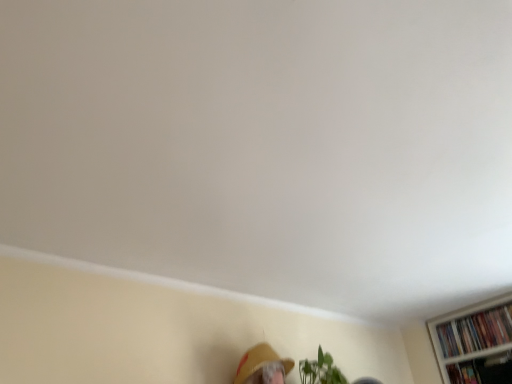
Question: Does matte yellow hat at lower center have a greater height compared to black matte bookshelf at lower right, positioned as the 1th book in front-to-back order?

Choices:
 (A) yes
 (B) no

Answer: (A)

Question: Is matte yellow hat at lower center positioned before black matte bookshelf at lower right, positioned as the 1th book in front-to-back order?

Choices:
 (A) yes
 (B) no

Answer: (A)

Question: Can you confirm if matte yellow hat at lower center is thinner than black matte bookshelf at lower right, the 2th book viewed from the back?

Choices:
 (A) no
 (B) yes

Answer: (A)

Question: Is the position of matte yellow hat at lower center more distant than that of black matte bookshelf at lower right, positioned as the 1th book in front-to-back order?

Choices:
 (A) yes
 (B) no

Answer: (B)

Question: From a real-world perspective, is matte yellow hat at lower center beneath black matte bookshelf at lower right, positioned as the 1th book in front-to-back order?

Choices:
 (A) no
 (B) yes

Answer: (A)

Question: Considering their positions, is matte yellow hat at lower center located in front of or behind black matte bookshelf at lower right, the 2th book viewed from the back?

Choices:
 (A) behind
 (B) front

Answer: (B)

Question: From the image's perspective, is matte yellow hat at lower center located above or below black matte bookshelf at lower right, positioned as the 1th book in front-to-back order?

Choices:
 (A) above
 (B) below

Answer: (A)

Question: Is matte yellow hat at lower center bigger or smaller than black matte bookshelf at lower right, the 2th book viewed from the back?

Choices:
 (A) big
 (B) small

Answer: (A)

Question: Is matte yellow hat at lower center taller or shorter than black matte bookshelf at lower right, the 2th book viewed from the back?

Choices:
 (A) short
 (B) tall

Answer: (B)

Question: Is black matte bookshelf at lower right, the 2th book viewed from the back, to the left or to the right of matte yellow hat at lower center in the image?

Choices:
 (A) right
 (B) left

Answer: (A)

Question: From the image's perspective, is black matte bookshelf at lower right, positioned as the 1th book in front-to-back order, positioned above or below matte yellow hat at lower center?

Choices:
 (A) below
 (B) above

Answer: (A)

Question: Is black matte bookshelf at lower right, positioned as the 1th book in front-to-back order, bigger or smaller than matte yellow hat at lower center?

Choices:
 (A) small
 (B) big

Answer: (A)

Question: Considering the positions of black matte bookshelf at lower right, positioned as the 1th book in front-to-back order, and matte yellow hat at lower center in the image, is black matte bookshelf at lower right, positioned as the 1th book in front-to-back order, wider or thinner than matte yellow hat at lower center?

Choices:
 (A) wide
 (B) thin

Answer: (B)

Question: From a real-world perspective, relative to multicolored paperbacks at upper right, the 2th book viewed from the front, is matte yellow hat at lower center vertically above or below?

Choices:
 (A) below
 (B) above

Answer: (A)

Question: In the image, is matte yellow hat at lower center positioned in front of or behind multicolored paperbacks at upper right, the 2th book viewed from the front?

Choices:
 (A) front
 (B) behind

Answer: (A)